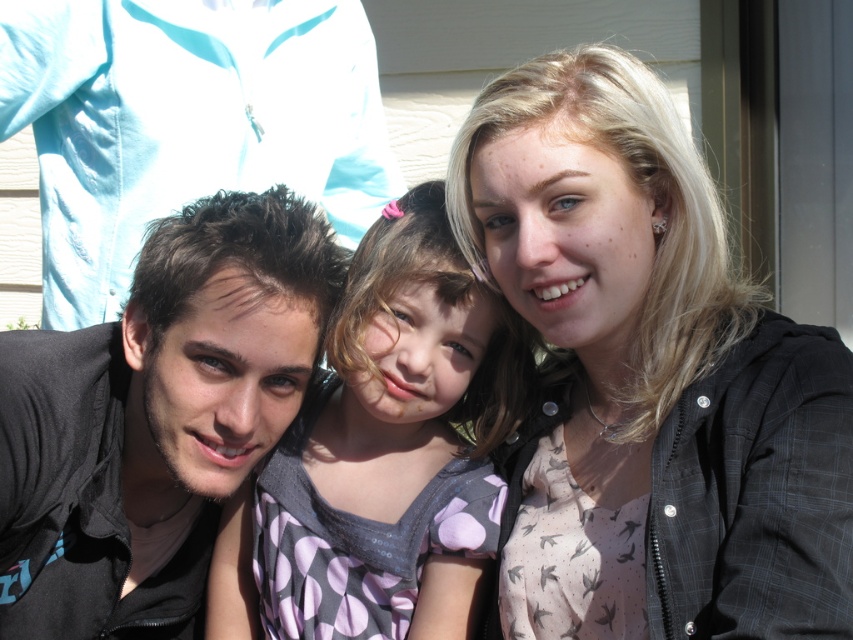
Can you confirm if blonde hair at upper right is thinner than polka dot fabric dress at center?

Indeed, blonde hair at upper right has a lesser width compared to polka dot fabric dress at center.

Is point (641, 355) positioned before point (264, 474)?

Yes, it is in front of point (264, 474).

Locate an element on the screen. The height and width of the screenshot is (640, 853). blonde hair at upper right is located at coordinates (648, 378).

Between point (86, 387) and point (312, 528), which one is positioned in front?

Positioned in front is point (86, 387).

Is point (90, 490) closer to camera compared to point (316, 464)?

Yes, it is.

Image resolution: width=853 pixels, height=640 pixels. In order to click on dark brown hair at left in this screenshot , I will do `click(155, 417)`.

Who is taller, blonde hair at upper right or dark brown hair at left?

blonde hair at upper right

Is blonde hair at upper right below dark brown hair at left?

No, blonde hair at upper right is not below dark brown hair at left.

You are a GUI agent. You are given a task and a screenshot of the screen. Output one action in this format:
    pyautogui.click(x=<x>, y=<y>)
    Task: Click on the blonde hair at upper right
    Image resolution: width=853 pixels, height=640 pixels.
    Given the screenshot: What is the action you would take?
    pyautogui.click(x=648, y=378)